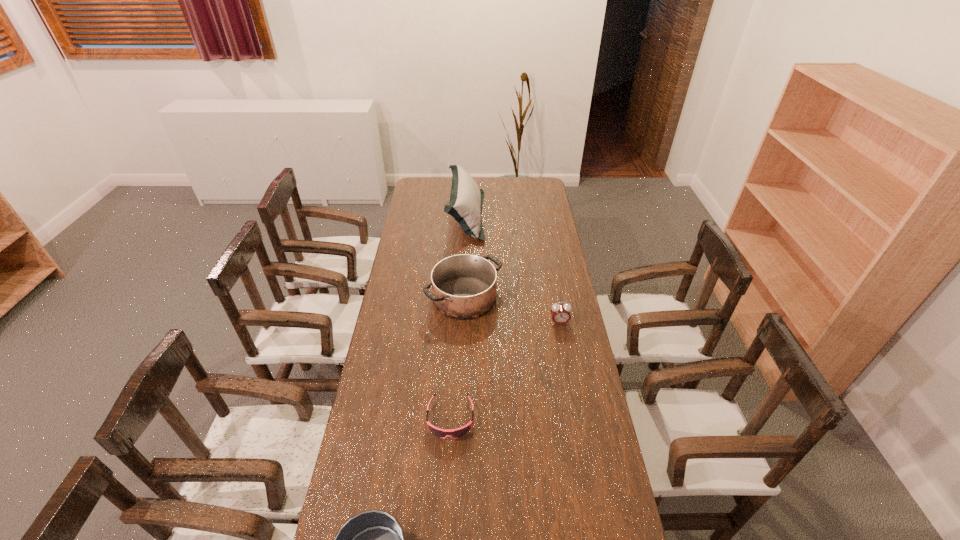
The height and width of the screenshot is (540, 960). In order to click on the tallest object in this screenshot , I will do `click(466, 199)`.

Identify the location of cushion. The width and height of the screenshot is (960, 540). (466, 199).

What are the coordinates of `the farther saucepan` in the screenshot? It's located at (464, 286).

Where is `alarm clock`? Image resolution: width=960 pixels, height=540 pixels. alarm clock is located at coordinates (560, 313).

Find the location of a particular element. the shortest object is located at coordinates 459,432.

This screenshot has height=540, width=960. I want to click on the fourth farthest object, so click(x=459, y=432).

Image resolution: width=960 pixels, height=540 pixels. I want to click on vacant space located on the surface of the cushion, so click(x=494, y=216).

Identify the location of free space located 0.130m on the left of the taller saucepan. The height and width of the screenshot is (540, 960). (396, 298).

Locate an element on the screen. The image size is (960, 540). free space located on the clock face of the alarm clock is located at coordinates (563, 342).

You are a GUI agent. You are given a task and a screenshot of the screen. Output one action in this format:
    pyautogui.click(x=<x>, y=<y>)
    Task: Click on the free space located 0.060m on the front-facing side of the goggles
    This screenshot has height=540, width=960.
    Given the screenshot: What is the action you would take?
    pyautogui.click(x=448, y=460)